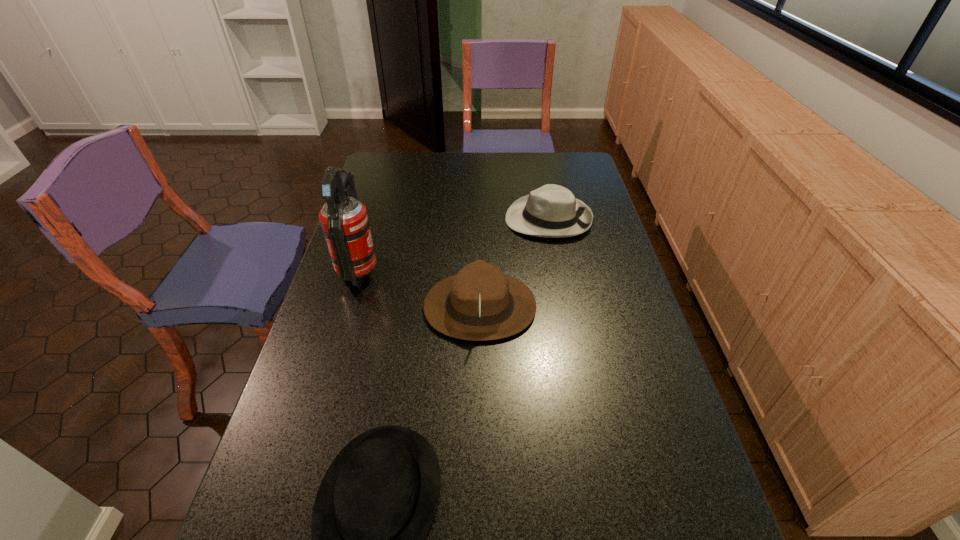
At what (x,y) coordinates should I click in order to perform the action: click on object present at the left edge. Please return your answer as a coordinate pair (x, y). The width and height of the screenshot is (960, 540). Looking at the image, I should click on (345, 225).

This screenshot has width=960, height=540. Find the location of `object at the right edge`. object at the right edge is located at coordinates (552, 211).

Find the location of `vacant space at the far edge of the desktop`. vacant space at the far edge of the desktop is located at coordinates (532, 163).

In the image, there is a desktop. At what (x,y) coordinates should I click in order to perform the action: click on vacant space at the left edge. Please return your answer as a coordinate pair (x, y). Looking at the image, I should click on (294, 398).

Where is `free location at the right edge`? free location at the right edge is located at coordinates (601, 233).

At what (x,y) coordinates should I click in order to perform the action: click on empty space that is in between the tallest object and the second tallest fedora. Please return your answer as a coordinate pair (x, y). Image resolution: width=960 pixels, height=540 pixels. Looking at the image, I should click on (454, 246).

Where is `free spot between the farthest fedora and the tallest fedora`? free spot between the farthest fedora and the tallest fedora is located at coordinates (515, 263).

The width and height of the screenshot is (960, 540). I want to click on free spot between the tallest fedora and the farthest fedora, so click(x=515, y=263).

Locate an element on the screen. the second closest object to the second tallest fedora is located at coordinates (x=345, y=225).

Locate an element on the screen. object identified as the third closest to the fire extinguisher is located at coordinates coord(376,503).